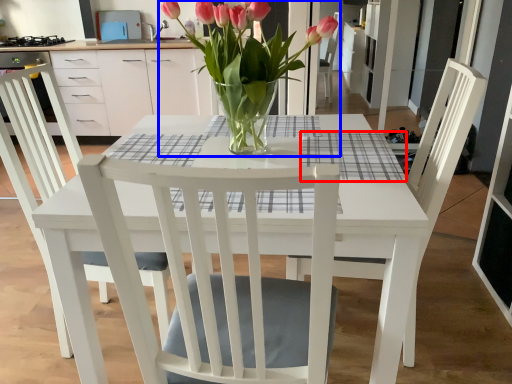
Question: Among these objects, which one is farthest to the camera, plaid (highlighted by a red box) or houseplant (highlighted by a blue box)?

Choices:
 (A) plaid
 (B) houseplant

Answer: (A)